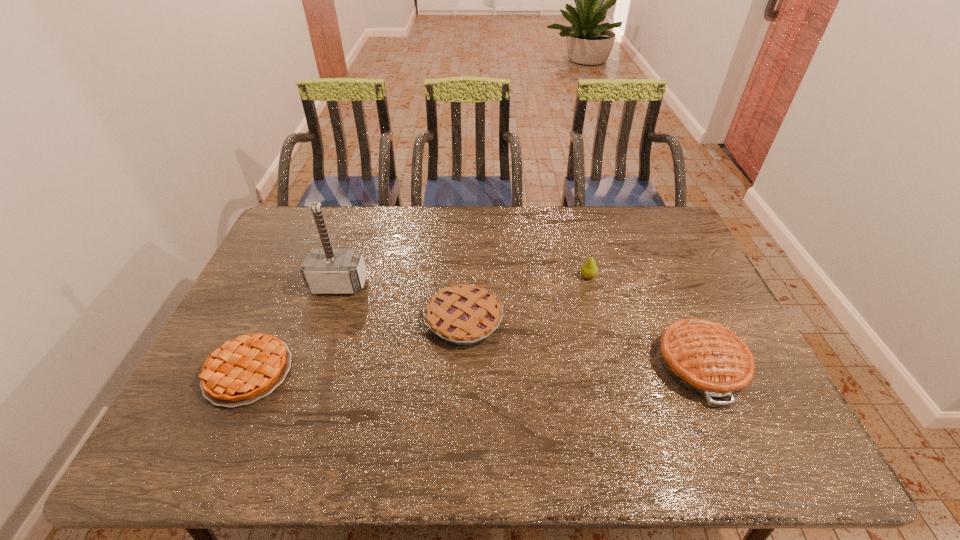
Where is `vacant space at the near right corner of the desktop`? vacant space at the near right corner of the desktop is located at coordinates (x=756, y=462).

Where is `free space between the second shortest object and the shortest object`? free space between the second shortest object and the shortest object is located at coordinates (356, 345).

Identify the location of free area in between the fourth object from left to right and the rightmost pie. click(644, 320).

What are the coordinates of `vacant space in between the hammer and the shortest pie` in the screenshot? It's located at (294, 328).

The height and width of the screenshot is (540, 960). I want to click on empty location between the leftmost pie and the tallest pie, so click(x=474, y=368).

Locate an element on the screen. vacant space in between the tallest pie and the leftmost pie is located at coordinates (474, 368).

Where is `unoccupied position between the shortest pie and the tallest object`? The image size is (960, 540). unoccupied position between the shortest pie and the tallest object is located at coordinates (294, 328).

The width and height of the screenshot is (960, 540). I want to click on empty space between the hammer and the pear, so click(464, 281).

You are a GUI agent. You are given a task and a screenshot of the screen. Output one action in this format:
    pyautogui.click(x=<x>, y=<y>)
    Task: Click on the free area in between the second shortest object and the second object from right to left
    The image size is (960, 540).
    Given the screenshot: What is the action you would take?
    pyautogui.click(x=526, y=298)

This screenshot has width=960, height=540. Identify the location of vacant area that lies between the tallest object and the shortest object. (294, 328).